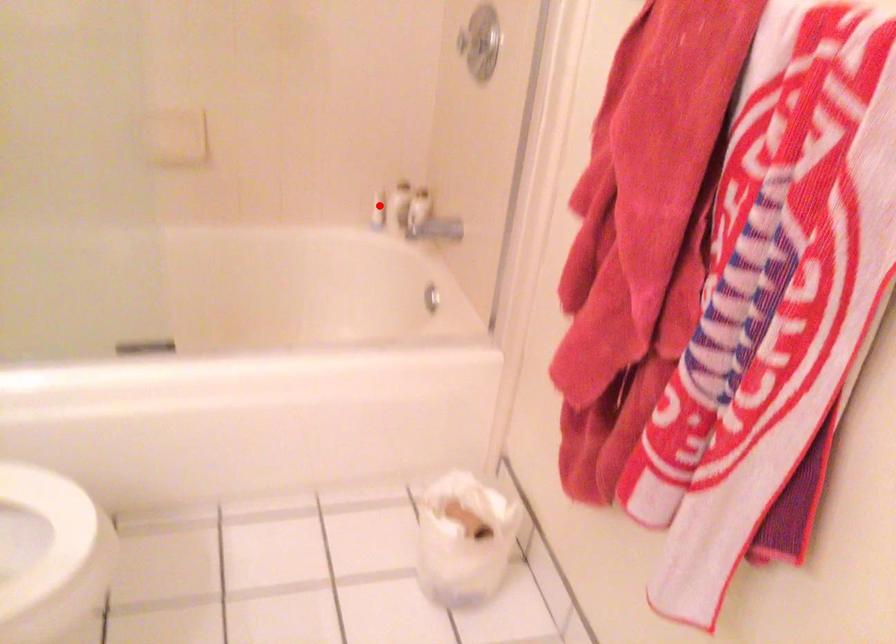
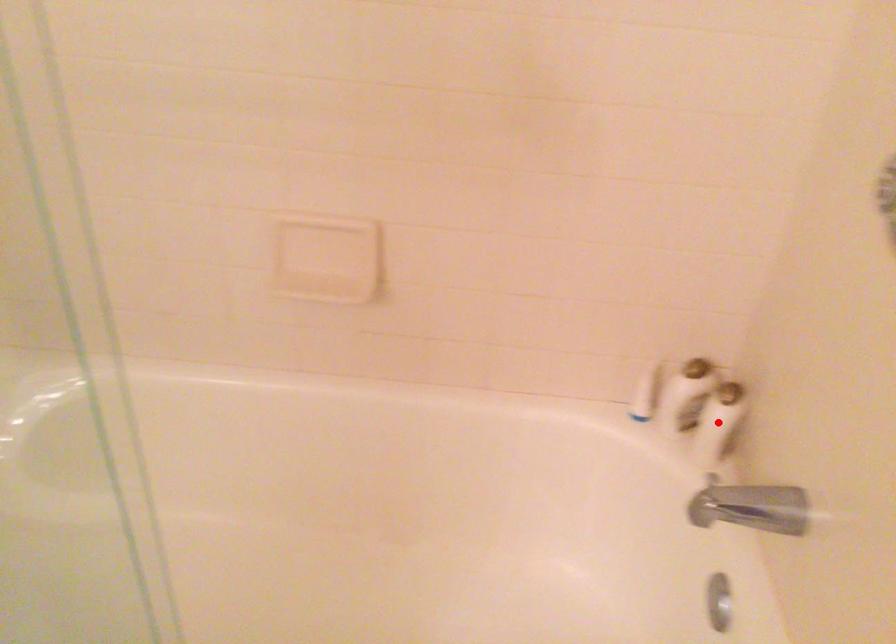
I am providing you with two images of the same scene from different viewpoints. A red point is marked on the first image and another point is marked on the second image. Is the marked point in image1 the same physical position as the marked point in image2?

No